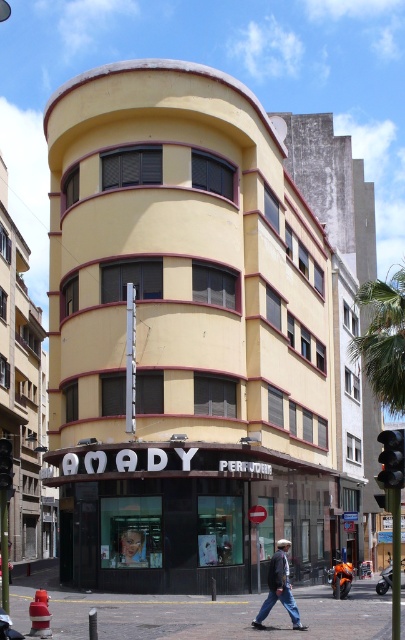
Question: Is smooth skin face at center above black plastic traffic light at center?

Choices:
 (A) yes
 (B) no

Answer: (B)

Question: Based on their relative distances, which object is nearer to the smooth skin face at center?

Choices:
 (A) green leafy palm tree at upper right
 (B) black plastic traffic light at center

Answer: (B)

Question: Which object is farther from the camera taking this photo?

Choices:
 (A) denim jacket at lower right
 (B) black plastic traffic light at center
 (C) black plastic traffic light at center right
 (D) green leafy palm tree at upper right

Answer: (D)

Question: Is black plastic traffic light at center right in front of smooth skin face at center?

Choices:
 (A) yes
 (B) no

Answer: (A)

Question: Can you confirm if denim jacket at lower right is bigger than black plastic traffic light at center right?

Choices:
 (A) no
 (B) yes

Answer: (A)

Question: Which point appears closest to the camera in this image?

Choices:
 (A) (396, 481)
 (B) (373, 376)
 (C) (6, 484)
 (D) (136, 532)

Answer: (A)